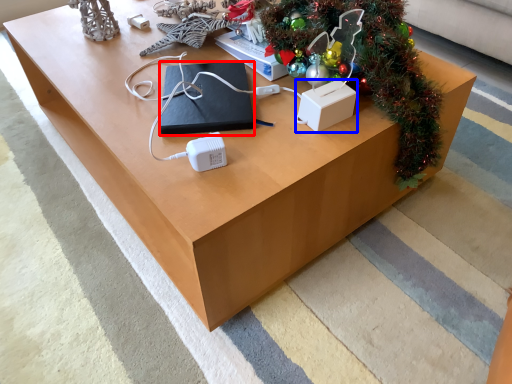
Question: Which object is closer to the camera taking this photo, pad (highlighted by a red box) or box (highlighted by a blue box)?

Choices:
 (A) pad
 (B) box

Answer: (B)